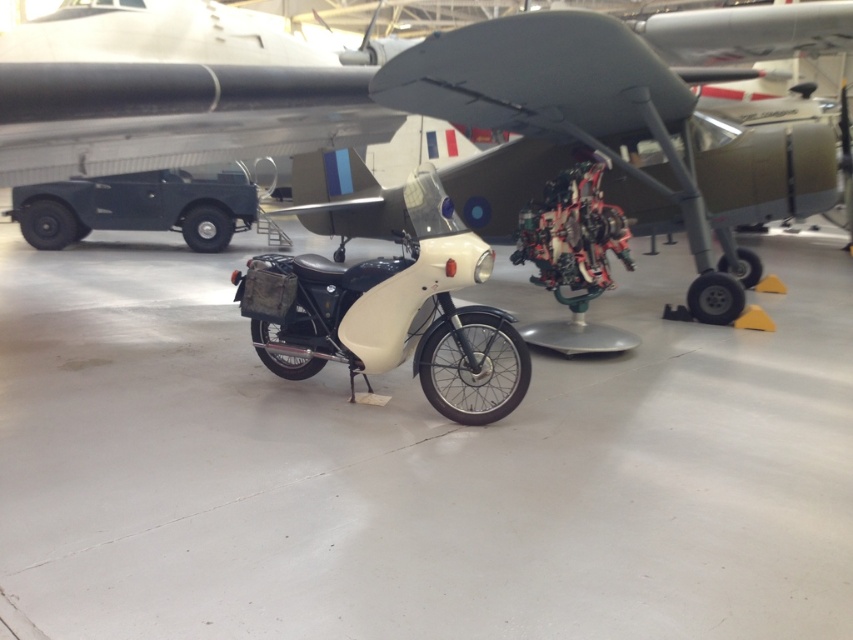
Which is behind, point (379, 136) or point (459, 372)?

The point (379, 136) is more distant.

This screenshot has width=853, height=640. What are the coordinates of `metallic gray airplane at center` in the screenshot? It's located at (357, 83).